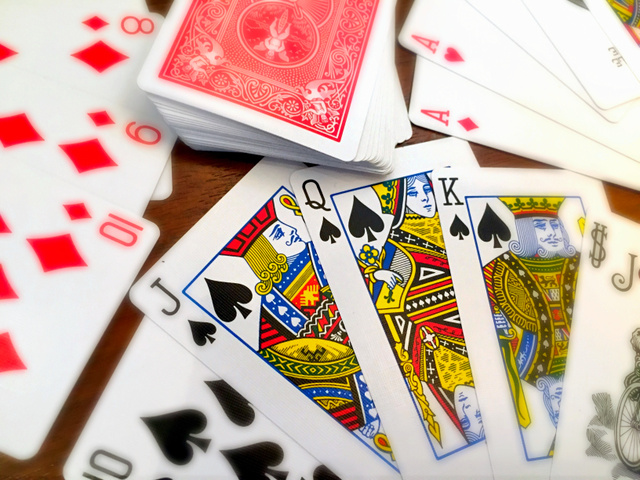
At what (x,y) coordinates should I click in order to perform the action: click on wooden table. Please return your answer as a coordinate pair (x, y). Looking at the image, I should click on (210, 181).